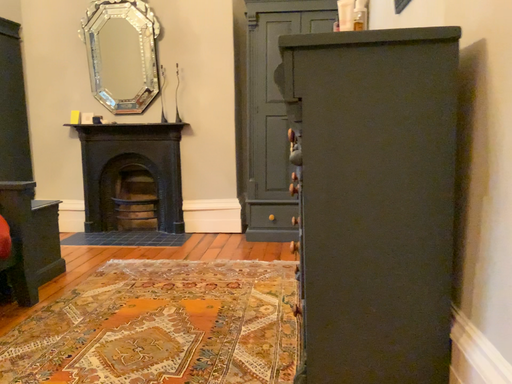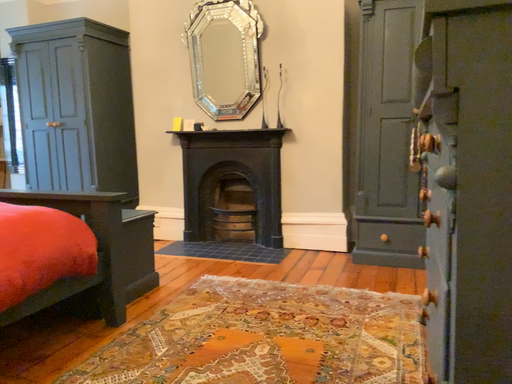
Question: Which way did the camera rotate in the video?

Choices:
 (A) rotated right
 (B) rotated left

Answer: (B)